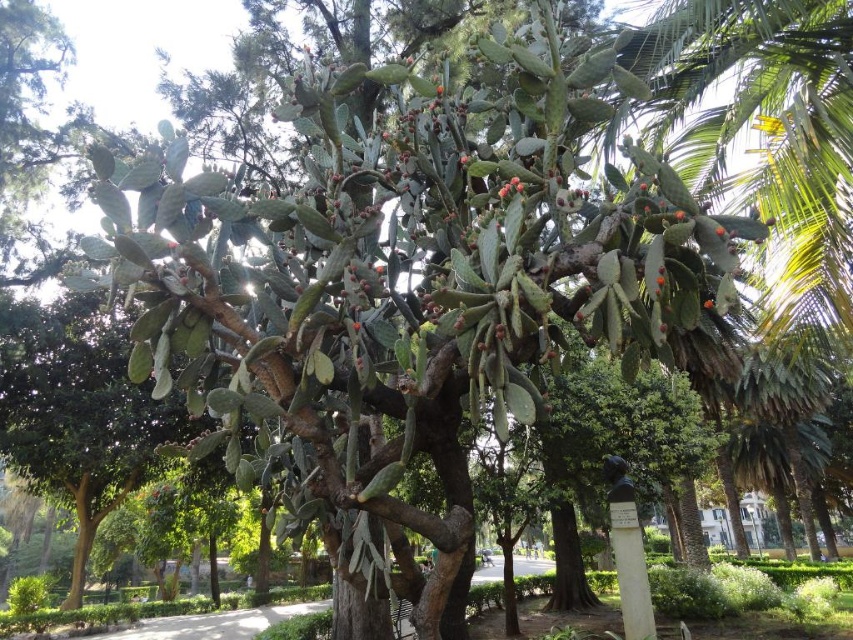
You are a gardener planning to plant a new tree in the park. You have a space that can accommodate a tree up to 3 meters wide. You see the green leafy palm tree at right and the red matte cactus at center. Which of these trees would fit in the space if the palm tree is wider than the cactus?

The red matte cactus at center would fit in the space since the green leafy palm tree at right is wider than the red matte cactus at center, and the space can only accommodate up to 3 meters wide.

You are a bird looking for a nesting spot in the park. You see the green leafy palm tree at right and the red matte cactus at center. Which tree would provide a higher nesting spot?

The green leafy palm tree at right is much taller than the red matte cactus at center, so it would provide a higher nesting spot.

You are standing on the paved pathway in the park and see the green leafy palm tree at right and the red matte cactus at center. Which one is positioned more to the east if the pathway runs north to south?

The green leafy palm tree at right is positioned to the right of the red matte cactus at center. Since the pathway runs north to south, the right side would correspond to the east direction. Therefore, the green leafy palm tree at right is more to the east.